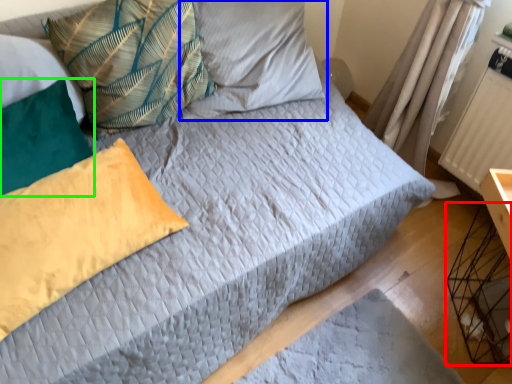
Question: Based on their relative distances, which object is farther from crate (highlighted by a red box)? Choose from pillow (highlighted by a blue box) and pillow (highlighted by a green box).

Choices:
 (A) pillow
 (B) pillow

Answer: (B)